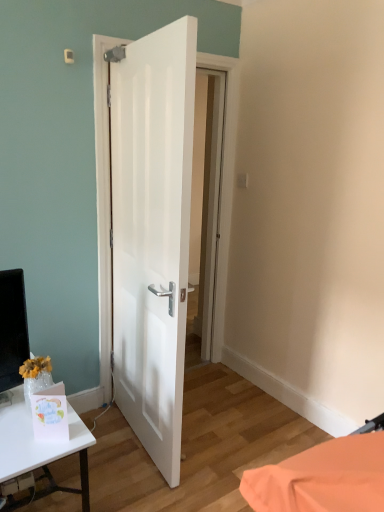
The height and width of the screenshot is (512, 384). Describe the element at coordinates (152, 233) in the screenshot. I see `white glossy door at center` at that location.

The height and width of the screenshot is (512, 384). I want to click on white glossy door at center, so click(x=152, y=233).

Locate an element on the screen. The image size is (384, 512). white glossy door at center is located at coordinates (152, 233).